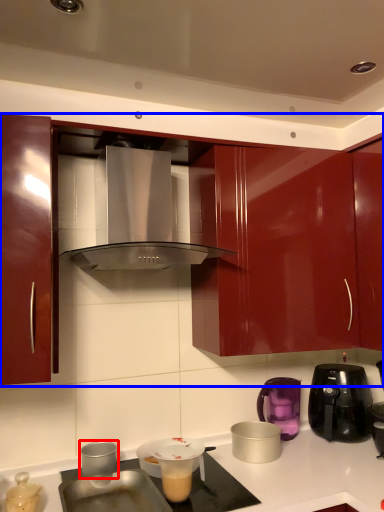
Question: Which object appears farthest to the camera in this image, kitchen appliance (highlighted by a red box) or cabinetry (highlighted by a blue box)?

Choices:
 (A) kitchen appliance
 (B) cabinetry

Answer: (A)